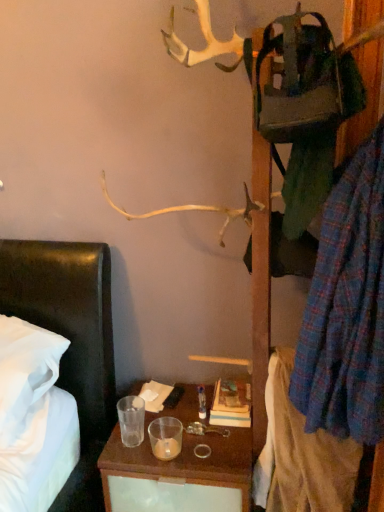
This screenshot has width=384, height=512. Describe the element at coordinates (347, 308) in the screenshot. I see `plaid fabric shirt at right, which is counted as the second clothing, starting from the bottom` at that location.

The image size is (384, 512). Find the location of `plaid fabric shirt at right, which is counted as the second clothing, starting from the bottom`. plaid fabric shirt at right, which is counted as the second clothing, starting from the bottom is located at coordinates (347, 308).

The height and width of the screenshot is (512, 384). What do you see at coordinates (300, 455) in the screenshot?
I see `plaid fabric shirt at right, the 1th clothing when ordered from bottom to top` at bounding box center [300, 455].

Locate an element on the screen. This screenshot has width=384, height=512. plaid fabric shirt at right, the 2th clothing positioned from the top is located at coordinates (300, 455).

Measure the distance between point (306, 440) and camera.

The depth of point (306, 440) is 1.20 meters.

Identify the location of plaid fabric shirt at right, which is counted as the second clothing, starting from the bottom. The image size is (384, 512). (347, 308).

Considering the positions of objects plaid fabric shirt at right, which is the 1th clothing in top-to-bottom order, and plaid fabric shirt at right, the 2th clothing positioned from the top, in the image provided, who is more to the right, plaid fabric shirt at right, which is the 1th clothing in top-to-bottom order, or plaid fabric shirt at right, the 2th clothing positioned from the top,?

Positioned to the right is plaid fabric shirt at right, which is the 1th clothing in top-to-bottom order.

Considering the relative positions of plaid fabric shirt at right, which is counted as the second clothing, starting from the bottom, and plaid fabric shirt at right, the 2th clothing positioned from the top, in the image provided, is plaid fabric shirt at right, which is counted as the second clothing, starting from the bottom, in front of plaid fabric shirt at right, the 2th clothing positioned from the top,?

Yes, plaid fabric shirt at right, which is counted as the second clothing, starting from the bottom, is in front of plaid fabric shirt at right, the 2th clothing positioned from the top.

Is point (310, 389) closer or farther from the camera than point (292, 461)?

Point (310, 389) is positioned closer to the camera compared to point (292, 461).

From the image's perspective, is plaid fabric shirt at right, which is counted as the second clothing, starting from the bottom, located beneath plaid fabric shirt at right, the 2th clothing positioned from the top?

Incorrect, from the image's perspective, plaid fabric shirt at right, which is counted as the second clothing, starting from the bottom, is higher than plaid fabric shirt at right, the 2th clothing positioned from the top.

From a real-world perspective, which object rests below the other?

plaid fabric shirt at right, the 2th clothing positioned from the top, is physically lower.

Considering the relative sizes of plaid fabric shirt at right, which is the 1th clothing in top-to-bottom order, and plaid fabric shirt at right, the 2th clothing positioned from the top, in the image provided, is plaid fabric shirt at right, which is the 1th clothing in top-to-bottom order, wider than plaid fabric shirt at right, the 2th clothing positioned from the top,?

No, plaid fabric shirt at right, which is the 1th clothing in top-to-bottom order, is not wider than plaid fabric shirt at right, the 2th clothing positioned from the top.

From the picture: Does plaid fabric shirt at right, which is the 1th clothing in top-to-bottom order, have a lesser height compared to plaid fabric shirt at right, the 1th clothing when ordered from bottom to top?

Incorrect, the height of plaid fabric shirt at right, which is the 1th clothing in top-to-bottom order, does not fall short of that of plaid fabric shirt at right, the 1th clothing when ordered from bottom to top.

Considering the sizes of objects plaid fabric shirt at right, which is counted as the second clothing, starting from the bottom, and plaid fabric shirt at right, the 1th clothing when ordered from bottom to top, in the image provided, who is bigger, plaid fabric shirt at right, which is counted as the second clothing, starting from the bottom, or plaid fabric shirt at right, the 1th clothing when ordered from bottom to top,?

With larger size is plaid fabric shirt at right, which is counted as the second clothing, starting from the bottom.

Would you say plaid fabric shirt at right, which is counted as the second clothing, starting from the bottom, is outside plaid fabric shirt at right, the 2th clothing positioned from the top?

plaid fabric shirt at right, which is counted as the second clothing, starting from the bottom, is positioned outside plaid fabric shirt at right, the 2th clothing positioned from the top.

Is plaid fabric shirt at right, which is the 1th clothing in top-to-bottom order, not near plaid fabric shirt at right, the 2th clothing positioned from the top?

plaid fabric shirt at right, which is the 1th clothing in top-to-bottom order, is actually quite close to plaid fabric shirt at right, the 2th clothing positioned from the top.

Is plaid fabric shirt at right, which is the 1th clothing in top-to-bottom order, positioned with its back to plaid fabric shirt at right, the 1th clothing when ordered from bottom to top?

That's not correct — plaid fabric shirt at right, which is the 1th clothing in top-to-bottom order, is not looking away from plaid fabric shirt at right, the 1th clothing when ordered from bottom to top.

How distant is plaid fabric shirt at right, which is the 1th clothing in top-to-bottom order, from plaid fabric shirt at right, the 1th clothing when ordered from bottom to top?

The distance of plaid fabric shirt at right, which is the 1th clothing in top-to-bottom order, from plaid fabric shirt at right, the 1th clothing when ordered from bottom to top, is 10.16 inches.

Locate an element on the screen. Image resolution: width=384 pixels, height=512 pixels. clothing lying below the plaid fabric shirt at right, which is the 1th clothing in top-to-bottom order (from the image's perspective) is located at coordinates (300, 455).

Between plaid fabric shirt at right, the 2th clothing positioned from the top, and plaid fabric shirt at right, which is the 1th clothing in top-to-bottom order, which one appears on the right side from the viewer's perspective?

plaid fabric shirt at right, which is the 1th clothing in top-to-bottom order, is more to the right.

Relative to plaid fabric shirt at right, which is counted as the second clothing, starting from the bottom, is plaid fabric shirt at right, the 1th clothing when ordered from bottom to top, in front or behind?

Clearly, plaid fabric shirt at right, the 1th clothing when ordered from bottom to top, is behind plaid fabric shirt at right, which is counted as the second clothing, starting from the bottom.

Does point (274, 458) lie in front of point (333, 298)?

No, it is behind (333, 298).

From the picture: From the image's perspective, which object appears higher, plaid fabric shirt at right, the 1th clothing when ordered from bottom to top, or plaid fabric shirt at right, which is counted as the second clothing, starting from the bottom?

plaid fabric shirt at right, which is counted as the second clothing, starting from the bottom.

From a real-world perspective, is plaid fabric shirt at right, the 1th clothing when ordered from bottom to top, positioned above or below plaid fabric shirt at right, which is the 1th clothing in top-to-bottom order?

plaid fabric shirt at right, the 1th clothing when ordered from bottom to top, is situated lower than plaid fabric shirt at right, which is the 1th clothing in top-to-bottom order, in the real world.

Between plaid fabric shirt at right, the 1th clothing when ordered from bottom to top, and plaid fabric shirt at right, which is counted as the second clothing, starting from the bottom, which one has smaller width?

With smaller width is plaid fabric shirt at right, which is counted as the second clothing, starting from the bottom.

Considering the sizes of objects plaid fabric shirt at right, the 2th clothing positioned from the top, and plaid fabric shirt at right, which is counted as the second clothing, starting from the bottom, in the image provided, who is shorter, plaid fabric shirt at right, the 2th clothing positioned from the top, or plaid fabric shirt at right, which is counted as the second clothing, starting from the bottom,?

With less height is plaid fabric shirt at right, the 2th clothing positioned from the top.

Based on the photo, considering the relative sizes of plaid fabric shirt at right, the 1th clothing when ordered from bottom to top, and plaid fabric shirt at right, which is counted as the second clothing, starting from the bottom, in the image provided, is plaid fabric shirt at right, the 1th clothing when ordered from bottom to top, smaller than plaid fabric shirt at right, which is counted as the second clothing, starting from the bottom,?

Correct, plaid fabric shirt at right, the 1th clothing when ordered from bottom to top, occupies less space than plaid fabric shirt at right, which is counted as the second clothing, starting from the bottom.

Looking at this image, is plaid fabric shirt at right, the 2th clothing positioned from the top, inside or outside of plaid fabric shirt at right, which is counted as the second clothing, starting from the bottom?

plaid fabric shirt at right, the 2th clothing positioned from the top, is spatially situated outside plaid fabric shirt at right, which is counted as the second clothing, starting from the bottom.

Is the surface of plaid fabric shirt at right, the 2th clothing positioned from the top, in direct contact with plaid fabric shirt at right, which is counted as the second clothing, starting from the bottom?

No.

Is plaid fabric shirt at right, the 2th clothing positioned from the top, oriented away from plaid fabric shirt at right, which is the 1th clothing in top-to-bottom order?

That's not correct — plaid fabric shirt at right, the 2th clothing positioned from the top, is not looking away from plaid fabric shirt at right, which is the 1th clothing in top-to-bottom order.

Could you measure the distance between plaid fabric shirt at right, the 2th clothing positioned from the top, and plaid fabric shirt at right, which is the 1th clothing in top-to-bottom order?

plaid fabric shirt at right, the 2th clothing positioned from the top, is 10.16 inches from plaid fabric shirt at right, which is the 1th clothing in top-to-bottom order.

Identify the location of clothing below the plaid fabric shirt at right, which is the 1th clothing in top-to-bottom order (from a real-world perspective). (300, 455).

Identify the location of clothing in front of the plaid fabric shirt at right, the 1th clothing when ordered from bottom to top. This screenshot has height=512, width=384. (347, 308).

What are the coordinates of `clothing that is on the left side of plaid fabric shirt at right, which is the 1th clothing in top-to-bottom order` in the screenshot? It's located at (300, 455).